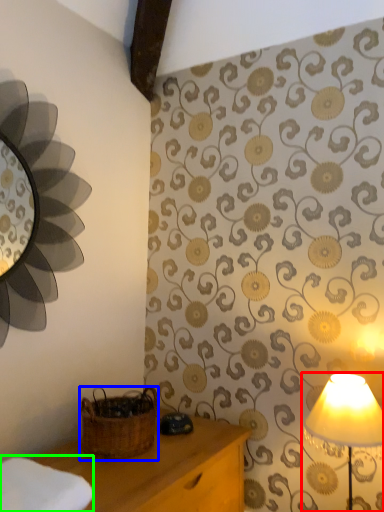
Question: Estimate the real-world distances between objects in this image. Which object is closer to lamp (highlighted by a red box), basket (highlighted by a blue box) or cloth (highlighted by a green box)?

Choices:
 (A) basket
 (B) cloth

Answer: (A)